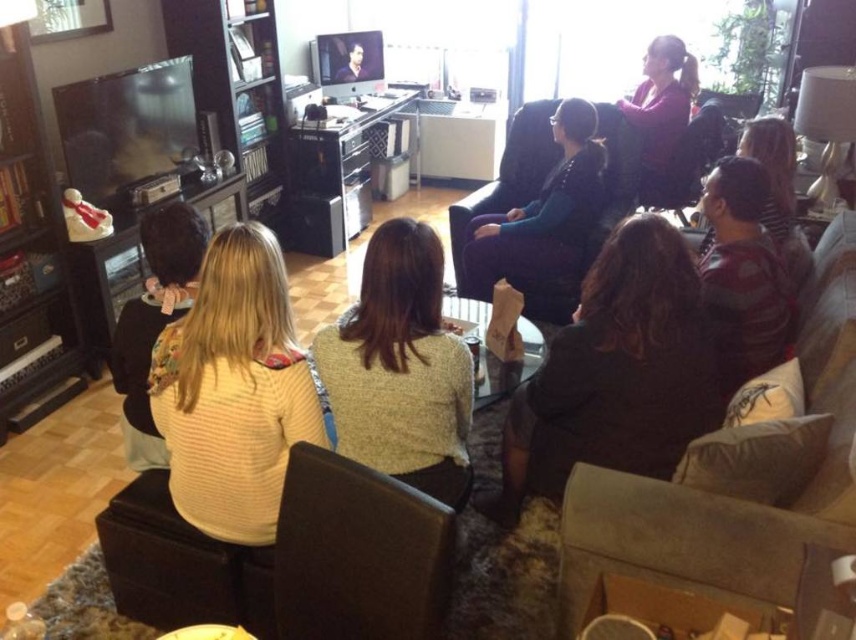
Between point (171, 422) and point (339, 509), which one is positioned in front?

Positioned in front is point (339, 509).

Who is lower down, yellow striped sweater at center or dark brown leather armchair at center?

Positioned lower is dark brown leather armchair at center.

Is point (270, 284) positioned after point (290, 570)?

Yes, point (270, 284) is farther from viewer.

The height and width of the screenshot is (640, 856). I want to click on yellow striped sweater at center, so click(x=233, y=390).

Which is more to the right, striped cotton shirt at right or smooth skin face at upper center?

From the viewer's perspective, striped cotton shirt at right appears more on the right side.

Between striped cotton shirt at right and smooth skin face at upper center, which one has less height?

With less height is smooth skin face at upper center.

Which is in front, point (765, 353) or point (351, 77)?

Point (765, 353) is more forward.

Where is `striped cotton shirt at right`? Image resolution: width=856 pixels, height=640 pixels. striped cotton shirt at right is located at coordinates (744, 272).

Does knitted yellow sweater at center lie behind velvet dark purple armchair at center?

That is False.

Between point (432, 484) and point (568, 141), which one is positioned behind?

The point (568, 141) is behind.

Locate an element on the screen. This screenshot has width=856, height=640. knitted yellow sweater at center is located at coordinates (400, 369).